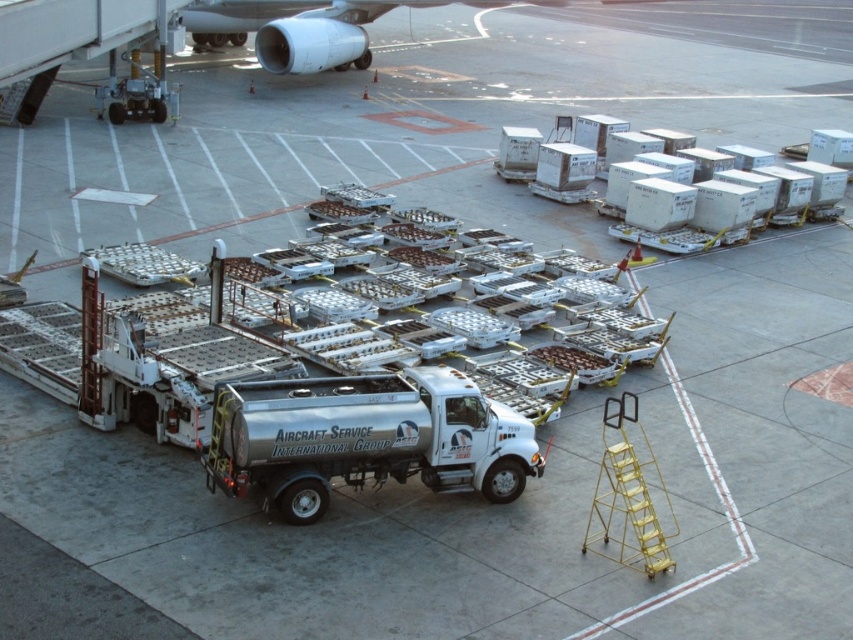
Question: Is silver metallic truck at center smaller than metallic silver engine at upper center?

Choices:
 (A) yes
 (B) no

Answer: (A)

Question: From the image, what is the correct spatial relationship of silver metallic truck at center in relation to metallic silver engine at upper center?

Choices:
 (A) left
 (B) right

Answer: (B)

Question: Which of the following is the farthest from the observer?

Choices:
 (A) (294, 54)
 (B) (223, 403)

Answer: (A)

Question: Is silver metallic truck at center to the left of metallic silver engine at upper center from the viewer's perspective?

Choices:
 (A) no
 (B) yes

Answer: (A)

Question: Among these points, which one is nearest to the camera?

Choices:
 (A) (397, 438)
 (B) (260, 42)

Answer: (A)